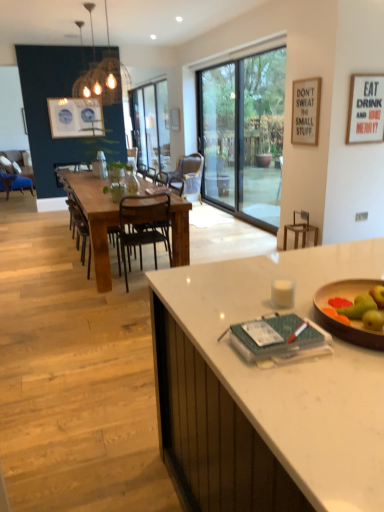
In order to click on free space in front of green matte apple at right in this screenshot , I will do `click(360, 361)`.